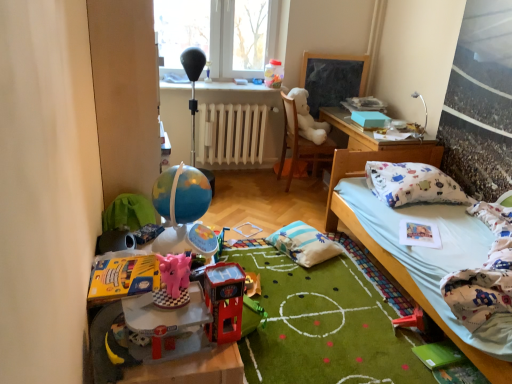
Question: From a real-world perspective, is transparent plastic window at upper center over pink plastic piggy bank at center, the fourth toy ordered from the bottom?

Choices:
 (A) no
 (B) yes

Answer: (B)

Question: Considering the relative sizes of transparent plastic window at upper center and pink plastic piggy bank at center, placed as the 2th toy when sorted from front to back, in the image provided, is transparent plastic window at upper center bigger than pink plastic piggy bank at center, placed as the 2th toy when sorted from front to back,?

Choices:
 (A) no
 (B) yes

Answer: (B)

Question: Is transparent plastic window at upper center far from pink plastic piggy bank at center, marked as the 4th toy in a back-to-front arrangement?

Choices:
 (A) no
 (B) yes

Answer: (B)

Question: Does transparent plastic window at upper center appear on the left side of pink plastic piggy bank at center, which is the fourth toy in right-to-left order?

Choices:
 (A) no
 (B) yes

Answer: (B)

Question: Is transparent plastic window at upper center oriented away from pink plastic piggy bank at center, which is the second toy from top to bottom?

Choices:
 (A) no
 (B) yes

Answer: (A)

Question: Considering the relative sizes of transparent plastic window at upper center and pink plastic piggy bank at center, which is the second toy from top to bottom, in the image provided, is transparent plastic window at upper center smaller than pink plastic piggy bank at center, which is the second toy from top to bottom,?

Choices:
 (A) yes
 (B) no

Answer: (B)

Question: Is rubber red toy at lower right, marked as the fifth toy in a top-to-bottom arrangement, behind shiny plastic toy car at center, the third toy positioned from the left?

Choices:
 (A) no
 (B) yes

Answer: (B)

Question: Considering the relative sizes of rubber red toy at lower right, the 2th toy positioned from the back, and shiny plastic toy car at center, which is counted as the third toy, starting from the top, in the image provided, is rubber red toy at lower right, the 2th toy positioned from the back, shorter than shiny plastic toy car at center, which is counted as the third toy, starting from the top,?

Choices:
 (A) yes
 (B) no

Answer: (A)

Question: Is rubber red toy at lower right, placed as the fourth toy when sorted from front to back, wider than shiny plastic toy car at center, which is counted as the third toy, starting from the top?

Choices:
 (A) yes
 (B) no

Answer: (A)

Question: Is rubber red toy at lower right, the 1th toy in the right-to-left sequence, surrounding shiny plastic toy car at center, which is counted as the third toy, starting from the top?

Choices:
 (A) yes
 (B) no

Answer: (B)

Question: Does rubber red toy at lower right, marked as the fifth toy in a top-to-bottom arrangement, turn towards shiny plastic toy car at center, which ranks as the 3th toy in bottom-to-top order?

Choices:
 (A) yes
 (B) no

Answer: (B)

Question: Can you confirm if rubber red toy at lower right, placed as the fourth toy when sorted from front to back, is bigger than shiny plastic toy car at center, which is counted as the third toy, starting from the top?

Choices:
 (A) yes
 (B) no

Answer: (B)

Question: Is pink plastic piggy bank at lower left, acting as the second toy starting from the bottom, completely or partially outside of pink plastic piggy bank at center, which is the second toy from top to bottom?

Choices:
 (A) yes
 (B) no

Answer: (A)